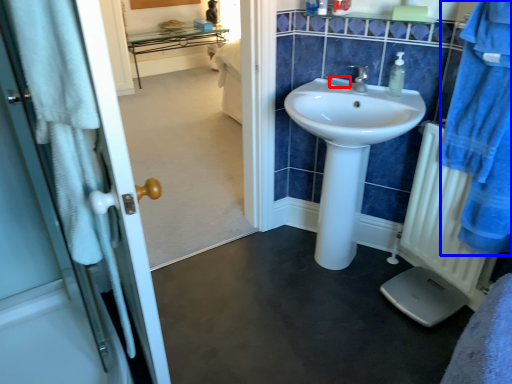
Question: Which object appears farthest to the camera in this image, soap (highlighted by a red box) or bathrobe (highlighted by a blue box)?

Choices:
 (A) soap
 (B) bathrobe

Answer: (A)